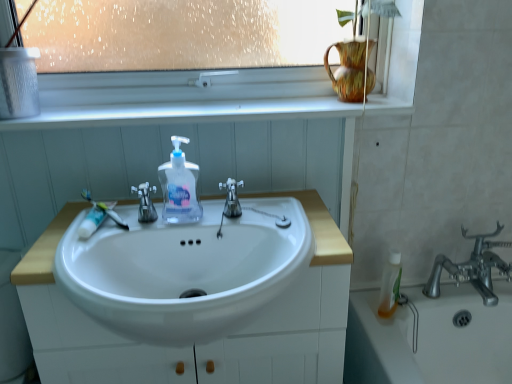
Where is `free spot in front of white matte toothpaste at left`? This screenshot has width=512, height=384. free spot in front of white matte toothpaste at left is located at coordinates (73, 250).